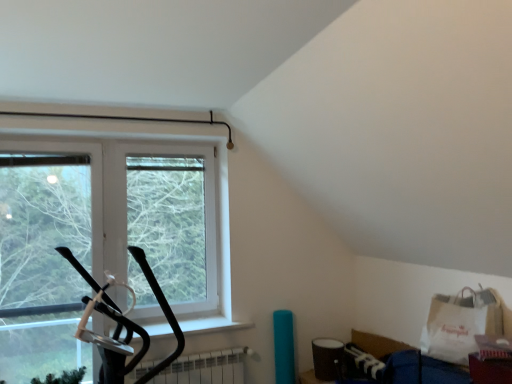
Question: Is clear glass window at center far from white paper grocery bag at lower right?

Choices:
 (A) no
 (B) yes

Answer: (B)

Question: Considering the relative sizes of clear glass window at center and white paper grocery bag at lower right in the image provided, is clear glass window at center bigger than white paper grocery bag at lower right?

Choices:
 (A) no
 (B) yes

Answer: (B)

Question: Is clear glass window at center to the left of white paper grocery bag at lower right from the viewer's perspective?

Choices:
 (A) yes
 (B) no

Answer: (A)

Question: Does clear glass window at center have a smaller size compared to white paper grocery bag at lower right?

Choices:
 (A) no
 (B) yes

Answer: (A)

Question: Does clear glass window at center have a greater width compared to white paper grocery bag at lower right?

Choices:
 (A) no
 (B) yes

Answer: (A)

Question: From the image's perspective, is white matte radiator at lower center above or below clear glass window at center?

Choices:
 (A) below
 (B) above

Answer: (A)

Question: Looking at the image, does white matte radiator at lower center seem bigger or smaller compared to clear glass window at center?

Choices:
 (A) big
 (B) small

Answer: (B)

Question: Is white matte radiator at lower center to the left or to the right of clear glass window at center in the image?

Choices:
 (A) right
 (B) left

Answer: (A)

Question: Is point (242, 349) closer or farther from the camera than point (134, 195)?

Choices:
 (A) closer
 (B) farther

Answer: (A)

Question: Is white paper grocery bag at lower right in front of or behind white matte radiator at lower center in the image?

Choices:
 (A) behind
 (B) front

Answer: (B)

Question: Considering the positions of point (468, 342) and point (209, 374), is point (468, 342) closer or farther from the camera than point (209, 374)?

Choices:
 (A) closer
 (B) farther

Answer: (A)

Question: In terms of height, does white paper grocery bag at lower right look taller or shorter compared to white matte radiator at lower center?

Choices:
 (A) tall
 (B) short

Answer: (A)

Question: From the image's perspective, is white paper grocery bag at lower right located above or below white matte radiator at lower center?

Choices:
 (A) below
 (B) above

Answer: (B)

Question: Is clear glass window at center to the left or to the right of white matte radiator at lower center in the image?

Choices:
 (A) right
 (B) left

Answer: (B)

Question: Considering the positions of point (202, 187) and point (228, 349), is point (202, 187) closer or farther from the camera than point (228, 349)?

Choices:
 (A) farther
 (B) closer

Answer: (A)